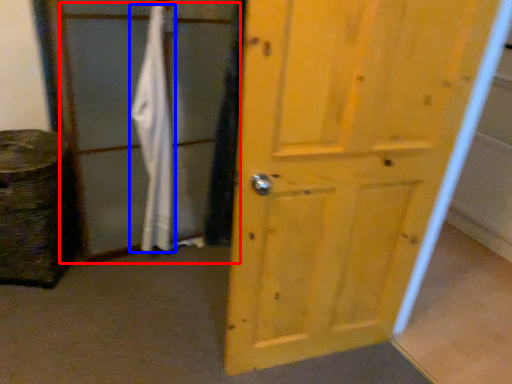
Question: Which object is closer to the camera taking this photo, screen door (highlighted by a red box) or bath towel (highlighted by a blue box)?

Choices:
 (A) screen door
 (B) bath towel

Answer: (A)